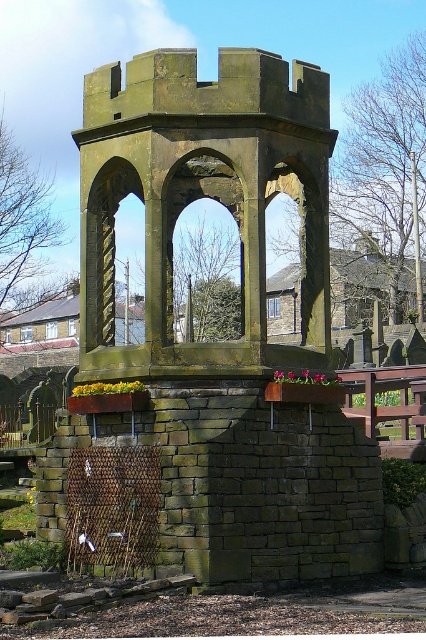
Question: Can you confirm if green stone gazebo at center is positioned to the left of rusty stone archway at center?

Choices:
 (A) no
 (B) yes

Answer: (B)

Question: Does green stone gazebo at center come behind carved stone archway at center?

Choices:
 (A) yes
 (B) no

Answer: (B)

Question: Which point is closer to the camera taking this photo?

Choices:
 (A) [x=89, y=196]
 (B) [x=150, y=298]

Answer: (B)

Question: Among these points, which one is farthest from the camera?

Choices:
 (A) (92, 317)
 (B) (244, 326)
 (C) (89, 189)

Answer: (B)

Question: In this image, where is carved stone archway at center located relative to rusty stone archway at center?

Choices:
 (A) left
 (B) right

Answer: (A)

Question: Which point appears closest to the camera in this image?

Choices:
 (A) (103, 321)
 (B) (210, 193)

Answer: (A)